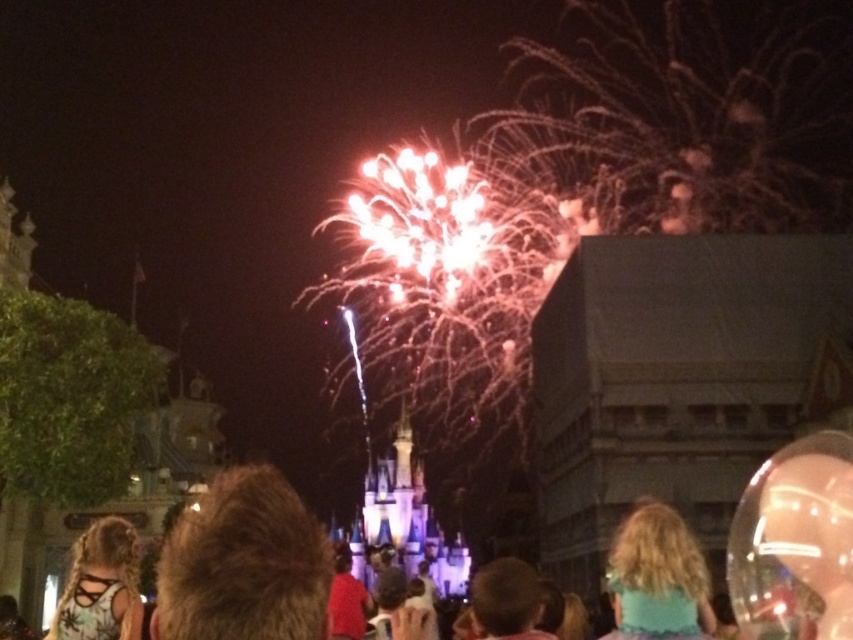
You are a photographer at the theme park and need to capture both the matte black tank top at lower left and the brown hair at center in a single frame. Which object should you focus on first to ensure both are in the frame?

You should focus on the matte black tank top at lower left first because its width is greater than the brown hair at center, allowing you to adjust the frame to include both.

You are a photographer trying to capture the teal fabric hair at center and the matte black tank top at lower left in the same frame. Which object should you zoom in on to ensure both fit in the photo?

The teal fabric hair at center is smaller than the matte black tank top at lower left, so you should zoom in on the teal fabric hair at center to ensure both fit in the photo.